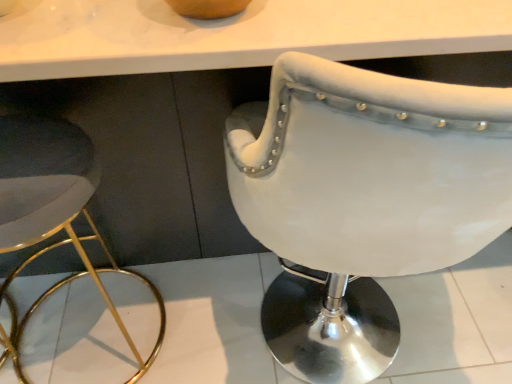
You are a GUI agent. You are given a task and a screenshot of the screen. Output one action in this format:
    pyautogui.click(x=<x>, y=<y>)
    Task: Click on the free region under white leather chair at center (from a real-world perspective)
    The height and width of the screenshot is (384, 512).
    Given the screenshot: What is the action you would take?
    pyautogui.click(x=314, y=337)